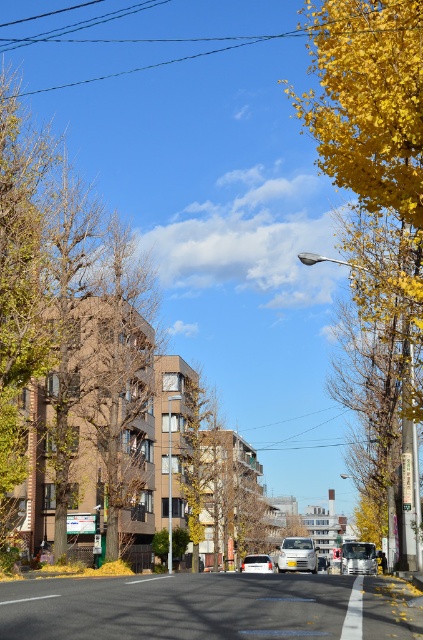
Is point (395, 134) closer to camera compared to point (148, 324)?

Yes, it is.

What are the coordinates of `yellow leafy tree at right` in the screenshot? It's located at (368, 100).

In the scene shown: Can you confirm if brown textured tree at center is smaller than matte silver van at center?

Yes, brown textured tree at center is smaller than matte silver van at center.

Can you confirm if brown textured tree at center is positioned to the left of matte silver van at center?

Yes, brown textured tree at center is to the left of matte silver van at center.

At what (x,y) coordinates should I click in order to perform the action: click on brown textured tree at center. Please return your answer as a coordinate pair (x, y). The width and height of the screenshot is (423, 640). Looking at the image, I should click on (120, 376).

Looking at this image, does yellow leafy tree at right appear on the right side of matte silver van at center?

Indeed, yellow leafy tree at right is positioned on the right side of matte silver van at center.

Is point (337, 33) positioned before point (302, 556)?

That is True.

Describe the element at coordinates (368, 100) in the screenshot. I see `yellow leafy tree at right` at that location.

The width and height of the screenshot is (423, 640). I want to click on yellow leafy tree at right, so click(368, 100).